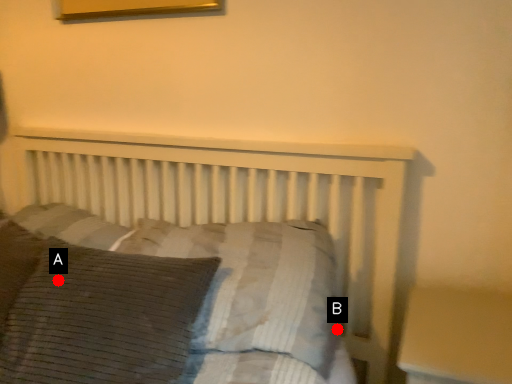
Question: Two points are circled on the image, labeled by A and B beside each circle. Among these points, which one is farthest from the camera?

Choices:
 (A) A is further
 (B) B is further

Answer: (B)